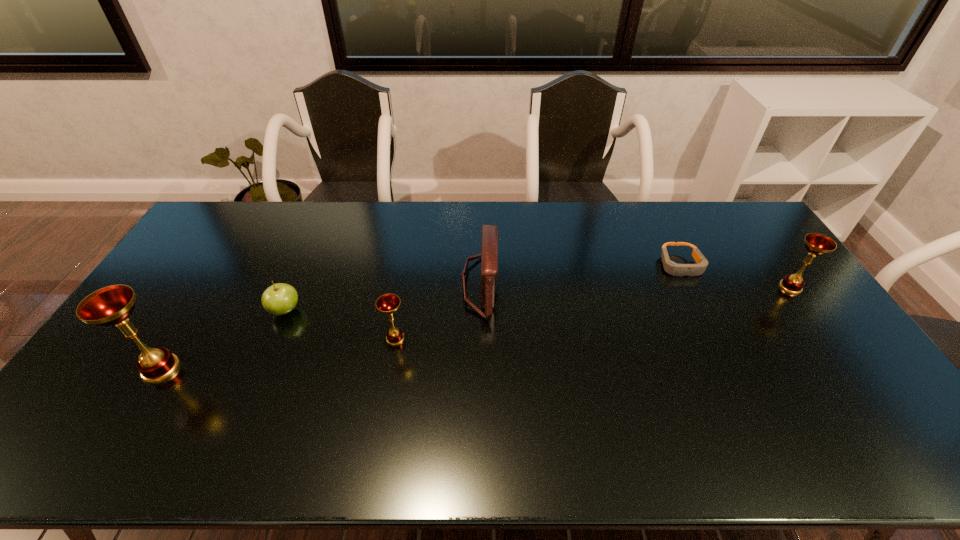
Please point a spot to place another chalice for symmetrical spacing. Please provide its 2D coordinates. Your answer should be formatted as a tuple, i.e. [(x, y)], where the tuple contains the x and y coordinates of a point satisfying the conditions above.

[(604, 312)]